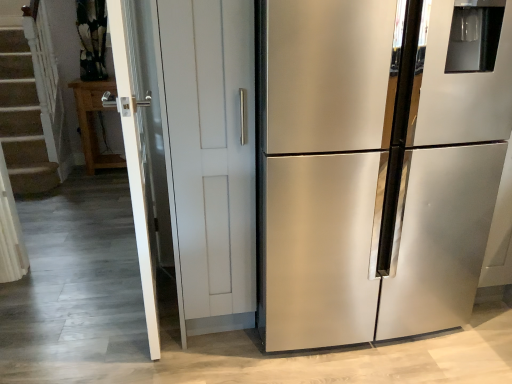
Question: From the image's perspective, relative to stainless steel refrigerator at right, is wooden cabinet at left above or below?

Choices:
 (A) above
 (B) below

Answer: (A)

Question: Is point (112, 167) positioned closer to the camera than point (295, 347)?

Choices:
 (A) farther
 (B) closer

Answer: (A)

Question: Which object is the closest to the wooden cabinet at left?

Choices:
 (A) stainless steel refrigerator at right
 (B) white glossy screen door at left

Answer: (B)

Question: Based on their relative distances, which object is nearer to the wooden cabinet at left?

Choices:
 (A) stainless steel refrigerator at right
 (B) white glossy screen door at left

Answer: (B)